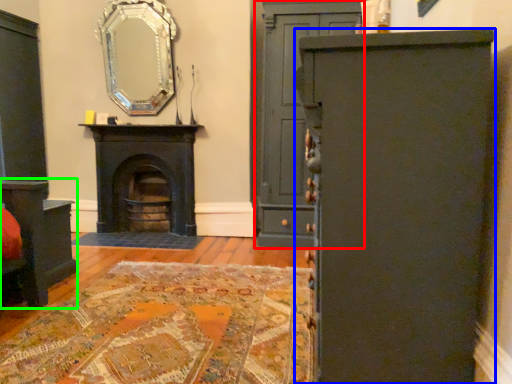
Question: Based on their relative distances, which object is nearer to door (highlighted by a red box)? Choose from cabinetry (highlighted by a blue box) and vanity (highlighted by a green box).

Choices:
 (A) cabinetry
 (B) vanity

Answer: (B)